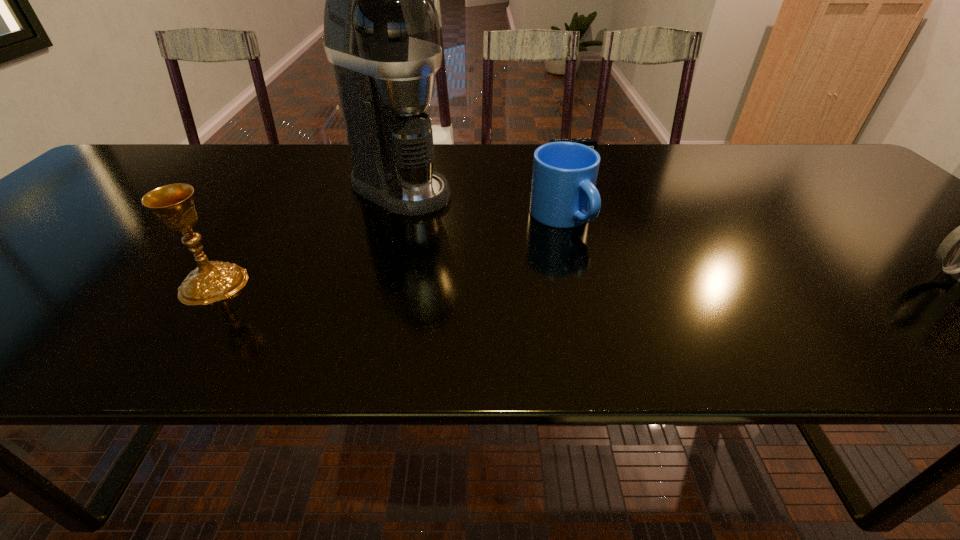
Identify the location of the fourth closest object to the rightmost object. (211, 281).

Where is `blank space that satisfies the following two spatial constraints: 1. on the back side of the leftmost object; 2. on the left side of the alarm clock`? This screenshot has height=540, width=960. blank space that satisfies the following two spatial constraints: 1. on the back side of the leftmost object; 2. on the left side of the alarm clock is located at coordinates (298, 161).

Find the location of a particular element. vacant region that satisfies the following two spatial constraints: 1. on the back side of the leftmost object; 2. on the right side of the left mug is located at coordinates (259, 217).

Locate an element on the screen. The height and width of the screenshot is (540, 960). vacant area that satisfies the following two spatial constraints: 1. on the back side of the second tallest object; 2. on the left side of the left mug is located at coordinates (259, 217).